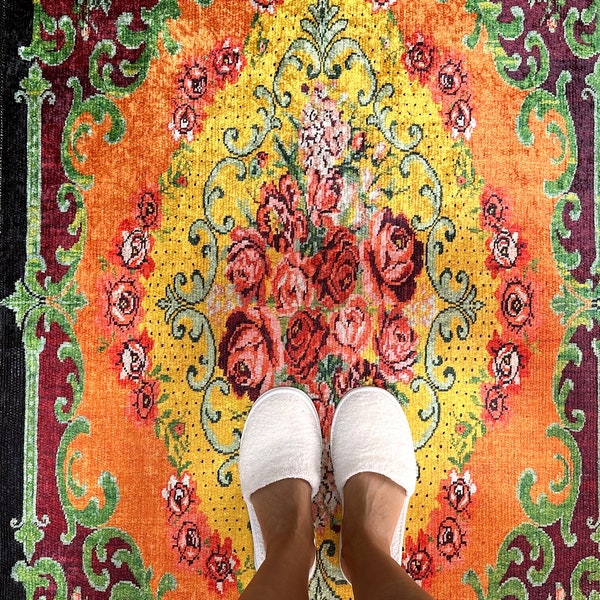
Find the location of a particular element. The image size is (600, 600). slippers is located at coordinates (288, 435), (389, 420).